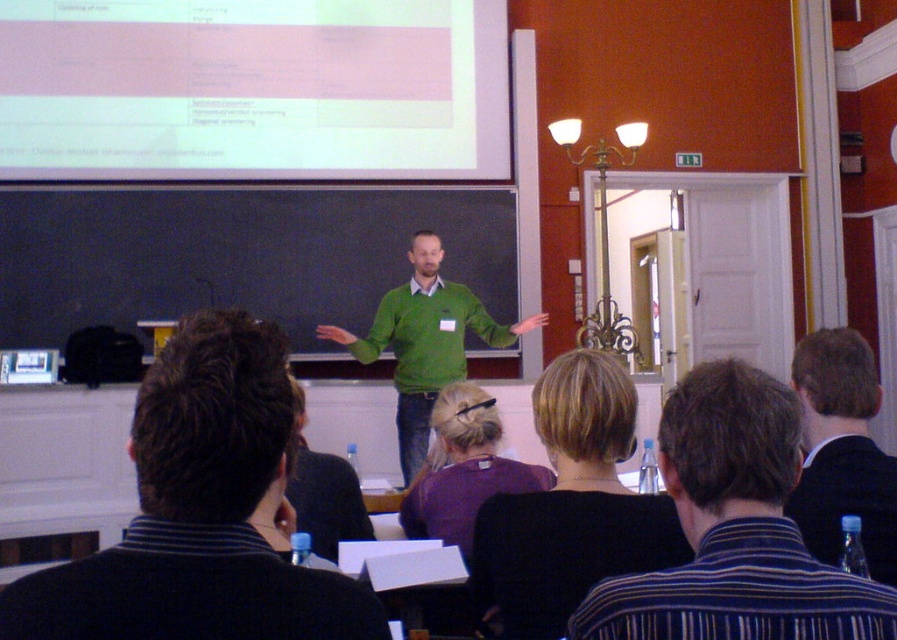
Question: Among these points, which one is farthest from the camera?

Choices:
 (A) (893, 490)
 (B) (718, 524)

Answer: (A)

Question: Estimate the real-world distances between objects in this image. Which object is farther from the dark suit jacket at right?

Choices:
 (A) dark brown hair at center
 (B) white matte projection screen at upper center

Answer: (B)

Question: Where is dark green sweater at center located in relation to dark brown hair at center in the image?

Choices:
 (A) above
 (B) below

Answer: (A)

Question: Is white matte projection screen at upper center positioned behind dark brown hair at center?

Choices:
 (A) no
 (B) yes

Answer: (B)

Question: Which object appears farthest from the camera in this image?

Choices:
 (A) dark suit jacket at right
 (B) green matte sweater at center
 (C) white matte projection screen at upper center

Answer: (C)

Question: Is white matte projection screen at upper center in front of dark green sweater at center?

Choices:
 (A) no
 (B) yes

Answer: (A)